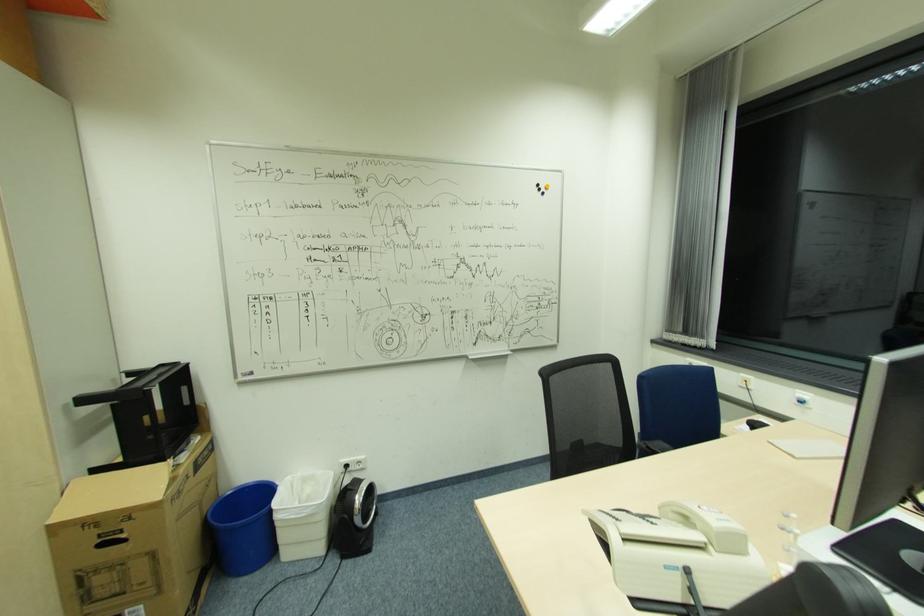
The height and width of the screenshot is (616, 924). I want to click on black chair armrest, so click(x=650, y=446).